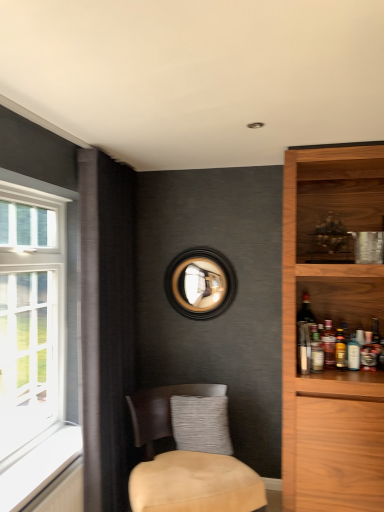
Locate an element on the screen. beige fabric chair at lower center is located at coordinates (195, 484).

What do you see at coordinates (353, 353) in the screenshot? I see `white plastic bottle at shelf right, which is counted as the third beverage, starting from the left` at bounding box center [353, 353].

What do you see at coordinates (200, 283) in the screenshot? The image size is (384, 512). I see `black wood picture frame at center` at bounding box center [200, 283].

Where is `beige fabric chair at lower center`? beige fabric chair at lower center is located at coordinates (195, 484).

From a real-world perspective, which object stands above the other?

translucent glass bottle at shelf right, the 4th beverage positioned from the right, is physically above.

Is point (319, 350) positioned in front of point (139, 510)?

No, it is not.

Between translucent glass bottle at shelf right, placed as the first beverage when sorted from left to right, and beige fabric chair at lower center, which one has smaller width?

With smaller width is translucent glass bottle at shelf right, placed as the first beverage when sorted from left to right.

Is translucent glass bottle at shelf right, placed as the first beverage when sorted from left to right, at the right side of beige fabric chair at lower center?

Yes, translucent glass bottle at shelf right, placed as the first beverage when sorted from left to right, is to the right of beige fabric chair at lower center.

Based on the photo, considering the positions of objects translucent glass bottle at shelf right, acting as the second beverage starting from the left, and gray textured pillow at center in the image provided, who is in front, translucent glass bottle at shelf right, acting as the second beverage starting from the left, or gray textured pillow at center?

gray textured pillow at center is in front.

From a real-world perspective, is translucent glass bottle at shelf right, acting as the 3th beverage starting from the right, beneath gray textured pillow at center?

Incorrect, from a real-world perspective, translucent glass bottle at shelf right, acting as the 3th beverage starting from the right, is higher than gray textured pillow at center.

Does translucent glass bottle at shelf right, acting as the 3th beverage starting from the right, have a greater width compared to gray textured pillow at center?

Incorrect, the width of translucent glass bottle at shelf right, acting as the 3th beverage starting from the right, does not surpass that of gray textured pillow at center.

At what (x,y) coordinates should I click in order to perform the action: click on chair that is below the white plastic bottle at shelf right, which is counted as the third beverage, starting from the left (from the image's perspective). Please return your answer as a coordinate pair (x, y). Looking at the image, I should click on (195, 484).

Could you tell me if beige fabric chair at lower center is turned towards white plastic bottle at shelf right, the 2th beverage when ordered from right to left?

No, beige fabric chair at lower center does not turn towards white plastic bottle at shelf right, the 2th beverage when ordered from right to left.

From the image's perspective, between beige fabric chair at lower center and white plastic bottle at shelf right, which is counted as the third beverage, starting from the left, who is located below?

beige fabric chair at lower center is shown below in the image.

From a real-world perspective, is beige fabric chair at lower center located higher than white plastic bottle at shelf right, which is counted as the third beverage, starting from the left?

Incorrect, from a real-world perspective, beige fabric chair at lower center is lower than white plastic bottle at shelf right, which is counted as the third beverage, starting from the left.

Is point (204, 475) positioned before point (315, 328)?

That is True.

How different are the orientations of beige fabric chair at lower center and translucent glass bottle at shelf right, placed as the first beverage when sorted from left to right, in degrees?

The angle between the facing direction of beige fabric chair at lower center and the facing direction of translucent glass bottle at shelf right, placed as the first beverage when sorted from left to right, is 31.9 degrees.

In the scene shown: Between beige fabric chair at lower center and translucent glass bottle at shelf right, placed as the first beverage when sorted from left to right, which one has less height?

translucent glass bottle at shelf right, placed as the first beverage when sorted from left to right, is shorter.

Can we say beige fabric chair at lower center lies outside translucent glass bottle at shelf right, placed as the first beverage when sorted from left to right?

Yes, beige fabric chair at lower center is outside of translucent glass bottle at shelf right, placed as the first beverage when sorted from left to right.

Considering the positions of objects translucent glass bottle at shelf right, placed as the first beverage when sorted from left to right, and black wood picture frame at center in the image provided, who is more to the right, translucent glass bottle at shelf right, placed as the first beverage when sorted from left to right, or black wood picture frame at center?

Positioned to the right is translucent glass bottle at shelf right, placed as the first beverage when sorted from left to right.

Is black wood picture frame at center surrounded by translucent glass bottle at shelf right, placed as the first beverage when sorted from left to right?

No.

From the image's perspective, starting from the black wood picture frame at center, which beverage is the 2nd one below? Please provide its 2D coordinates.

[(316, 351)]

Between point (190, 436) and point (358, 353), which one is positioned in front?

Positioned in front is point (358, 353).

From the image's perspective, which object appears higher, gray textured pillow at center or white plastic bottle at shelf right, which is counted as the third beverage, starting from the left?

white plastic bottle at shelf right, which is counted as the third beverage, starting from the left.

From the gray textured pillow at center, count 3rd beverage to the right and point to it. Please provide its 2D coordinates.

[(353, 353)]

Which of these two, gray textured pillow at center or white plastic bottle at shelf right, which is counted as the third beverage, starting from the left, stands shorter?

With less height is white plastic bottle at shelf right, which is counted as the third beverage, starting from the left.

From the picture: Which is more to the left, translucent glass bottle at shelf right, placed as the first beverage when sorted from left to right, or gray textured pillow at center?

gray textured pillow at center is more to the left.

Is point (310, 367) closer or farther from the camera than point (206, 442)?

Point (310, 367) appears to be closer to the viewer than point (206, 442).

Is translucent glass bottle at shelf right, placed as the first beverage when sorted from left to right, far away from gray textured pillow at center?

No, there isn't a large distance between translucent glass bottle at shelf right, placed as the first beverage when sorted from left to right, and gray textured pillow at center.

Considering the sizes of translucent glass bottle at shelf right, placed as the first beverage when sorted from left to right, and gray textured pillow at center in the image, is translucent glass bottle at shelf right, placed as the first beverage when sorted from left to right, taller or shorter than gray textured pillow at center?

In the image, translucent glass bottle at shelf right, placed as the first beverage when sorted from left to right, appears to be shorter than gray textured pillow at center.

Identify the location of chair in front of the translucent glass bottle at shelf right, placed as the first beverage when sorted from left to right. (195, 484).

Locate an element on the screen. This screenshot has height=512, width=384. the 2nd beverage to the right of the gray textured pillow at center, starting your count from the anchor is located at coordinates (328, 343).

From the image, which object appears to be farther from translucent glass bottle at shelf right, placed as the first beverage when sorted from left to right, white plastic bottle at shelf right, the 2th beverage when ordered from right to left, or black wood picture frame at center?

black wood picture frame at center is positioned further to the anchor translucent glass bottle at shelf right, placed as the first beverage when sorted from left to right.

Based on the photo, when comparing their distances from translucent glass bottle at shelf right, acting as the 3th beverage starting from the right, does translucent glass bottle at shelf right, the 4th beverage positioned from the right, or gray textured pillow at center seem further?

Based on the image, gray textured pillow at center appears to be further to translucent glass bottle at shelf right, acting as the 3th beverage starting from the right.

Looking at the image, which one is located closer to translucent glass bottle at shelf right, placed as the first beverage when sorted from left to right, black wood picture frame at center or gray textured pillow at center?

The object closer to translucent glass bottle at shelf right, placed as the first beverage when sorted from left to right, is gray textured pillow at center.

Based on their spatial positions, is translucent glass bottle at shelf right, placed as the first beverage when sorted from left to right, or translucent glass bottle at shelf right, the fourth beverage from the left, further from white plastic bottle at shelf right, the 2th beverage when ordered from right to left?

Based on the image, translucent glass bottle at shelf right, placed as the first beverage when sorted from left to right, appears to be further to white plastic bottle at shelf right, the 2th beverage when ordered from right to left.

From the image, which object appears to be farther from beige fabric chair at lower center, translucent glass bottle at shelf right, the first beverage positioned from the right, or translucent glass bottle at shelf right, the 4th beverage positioned from the right?

translucent glass bottle at shelf right, the first beverage positioned from the right, lies further to beige fabric chair at lower center than the other object.

Estimate the real-world distances between objects in this image. Which object is further from translucent glass bottle at shelf right, acting as the second beverage starting from the left, white plastic bottle at shelf right, the 2th beverage when ordered from right to left, or black wood picture frame at center?

black wood picture frame at center is further to translucent glass bottle at shelf right, acting as the second beverage starting from the left.

Looking at this image, based on their spatial positions, is beige fabric chair at lower center or black wood picture frame at center closer to white plastic bottle at shelf right, which is counted as the third beverage, starting from the left?

Based on the image, black wood picture frame at center appears to be nearer to white plastic bottle at shelf right, which is counted as the third beverage, starting from the left.

Considering their positions, is translucent glass bottle at shelf right, the fourth beverage from the left, positioned closer to beige fabric chair at lower center than gray textured pillow at center?

Based on the image, gray textured pillow at center appears to be nearer to beige fabric chair at lower center.

The image size is (384, 512). What are the coordinates of `pillow situated between beige fabric chair at lower center and translucent glass bottle at shelf right, the first beverage positioned from the right, from left to right` in the screenshot? It's located at (201, 424).

I want to click on beverage located between black wood picture frame at center and translucent glass bottle at shelf right, acting as the 3th beverage starting from the right, in the left-right direction, so click(316, 351).

Where is `picture frame situated between gray textured pillow at center and white plastic bottle at shelf right, the 2th beverage when ordered from right to left, from left to right`? picture frame situated between gray textured pillow at center and white plastic bottle at shelf right, the 2th beverage when ordered from right to left, from left to right is located at coordinates (x=200, y=283).

Where is `picture frame located between gray textured pillow at center and translucent glass bottle at shelf right, acting as the 3th beverage starting from the right, in the left-right direction`? This screenshot has height=512, width=384. picture frame located between gray textured pillow at center and translucent glass bottle at shelf right, acting as the 3th beverage starting from the right, in the left-right direction is located at coordinates (200, 283).